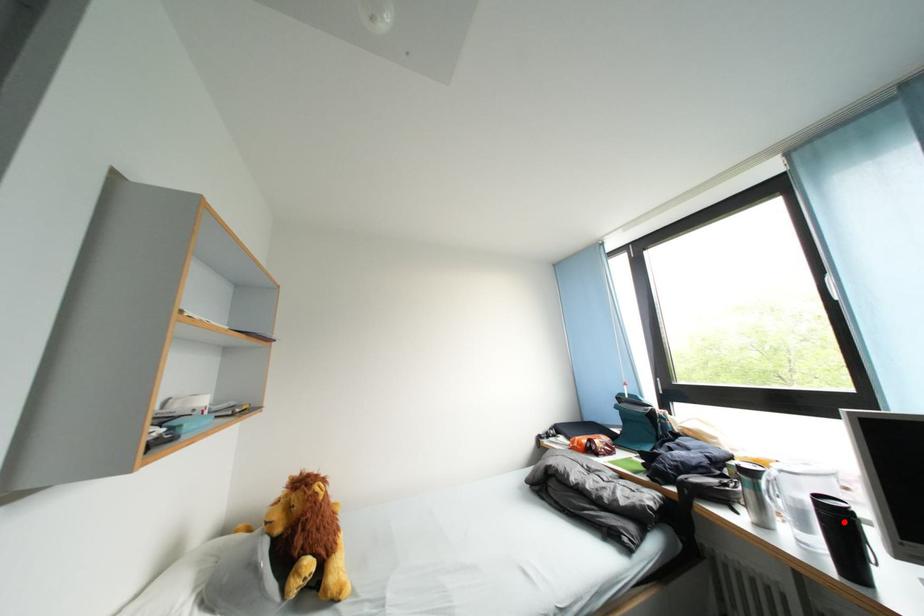
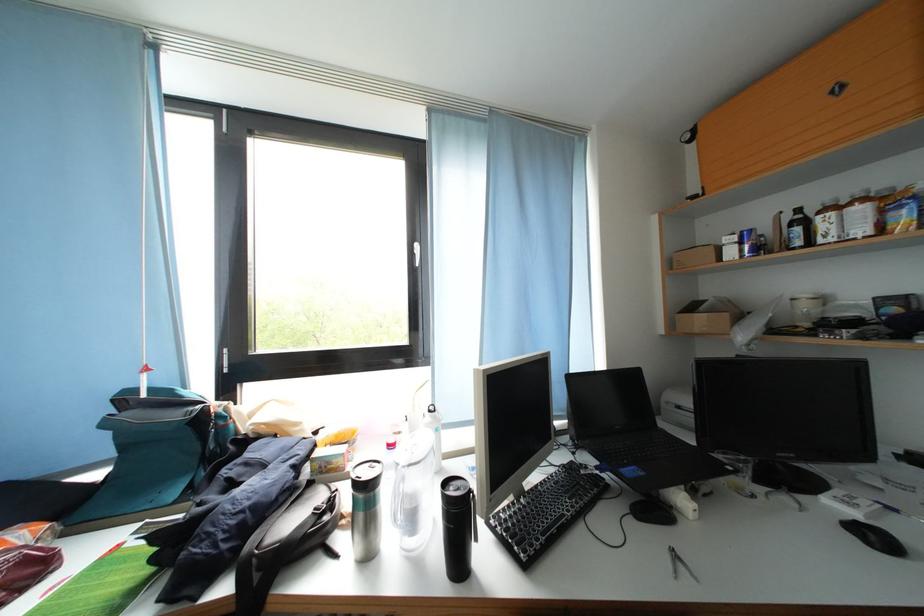
Question: I am providing you with two images of the same scene from different viewpoints. A red point is shown in image1. For the corresponding object point in image2, is it positioned nearer or farther from the camera?

Choices:
 (A) Nearer
 (B) Farther

Answer: (B)